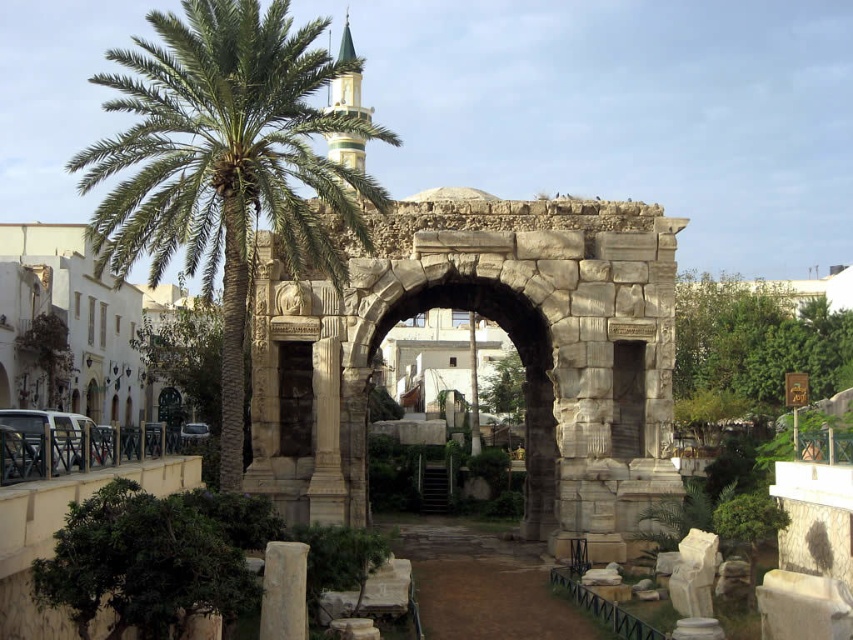
Is light beige stone column at lower center smaller than dark stone arch at center?

Yes.

Is light beige stone column at lower center shorter than dark stone arch at center?

Yes, light beige stone column at lower center is shorter than dark stone arch at center.

Who is more forward, (265, 632) or (281, 380)?

Point (265, 632) is more forward.

I want to click on light beige stone column at lower center, so click(283, 592).

Which is in front, point (270, 541) or point (630, 390)?

Point (270, 541) is in front.

Can you confirm if light beige stone column at lower center is shorter than gray stone arch at center?

Yes, light beige stone column at lower center is shorter than gray stone arch at center.

The width and height of the screenshot is (853, 640). I want to click on light beige stone column at lower center, so click(x=283, y=592).

This screenshot has height=640, width=853. I want to click on light beige stone column at lower center, so click(x=283, y=592).

Does green leafy palm at center appear on the left side of stone archway at center?

Indeed, green leafy palm at center is positioned on the left side of stone archway at center.

Who is more forward, (227, 276) or (471, 369)?

Positioned in front is point (227, 276).

Find the location of a particular element. The height and width of the screenshot is (640, 853). green leafy palm at center is located at coordinates (224, 164).